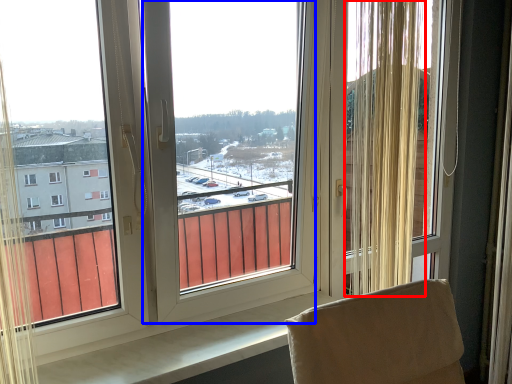
Question: Which point is closer to the camera, curtain (highlighted by a red box) or window screen (highlighted by a blue box)?

Choices:
 (A) curtain
 (B) window screen

Answer: (B)